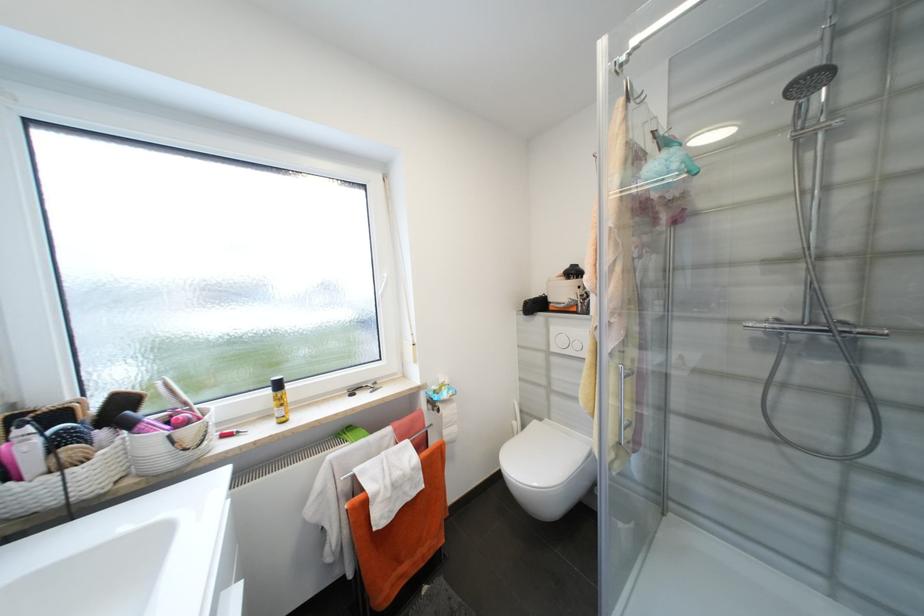
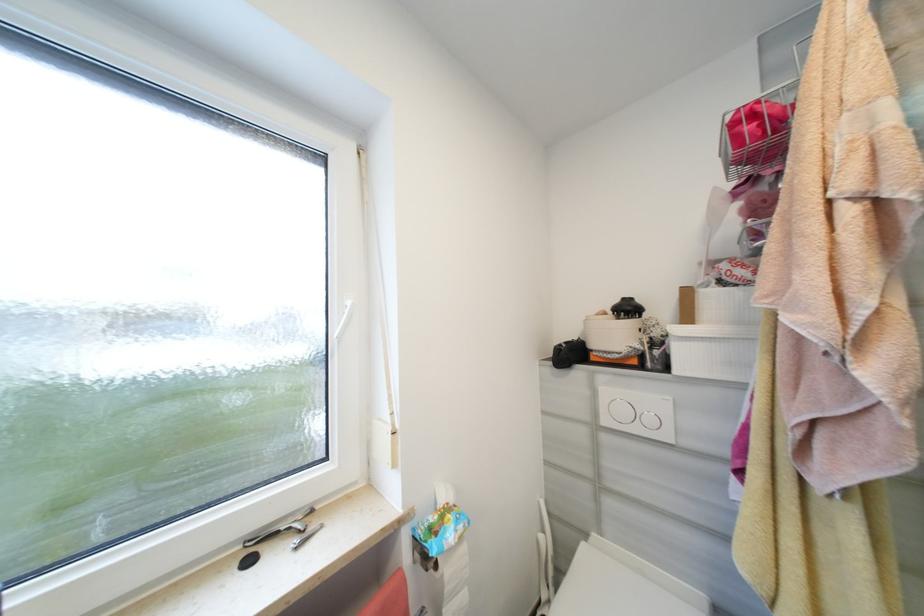
Question: In a continuous first-person perspective shot, in which direction is the camera moving?

Choices:
 (A) Left
 (B) Right
 (C) Forward
 (D) Backward

Answer: (C)